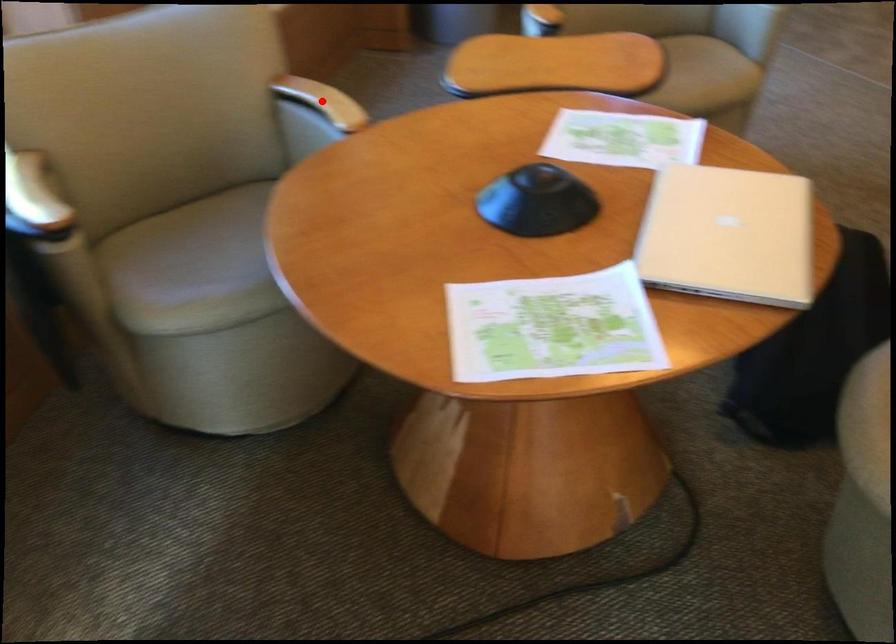
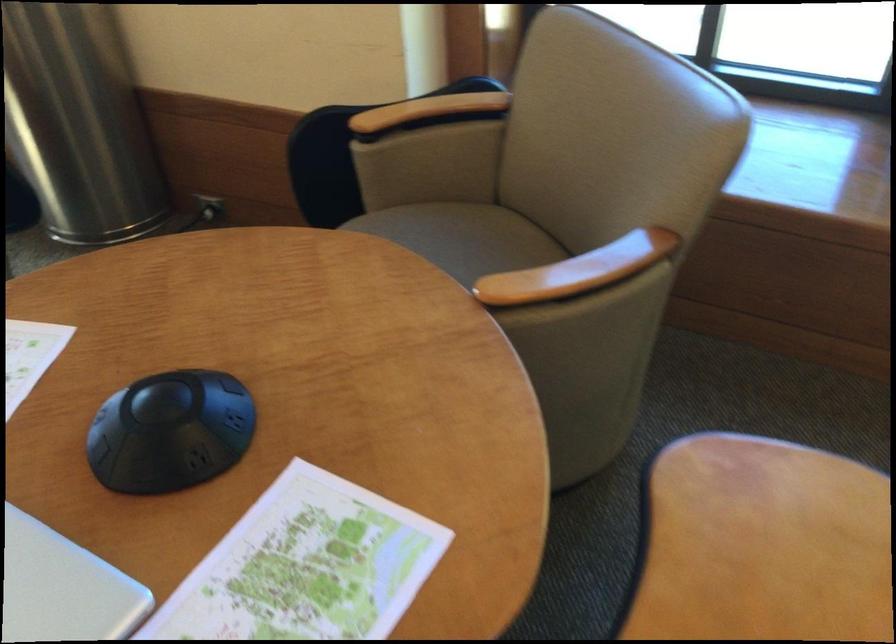
Question: I am providing you with two images of the same scene from different viewpoints. A red point is marked on the first image. Is the red point's position out of view in image 2?

Choices:
 (A) Yes
 (B) No

Answer: (A)